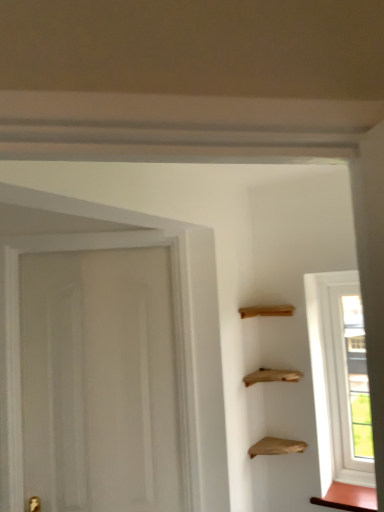
Question: Is wooden shelves at upper right, arranged as the 2th cabinetry when viewed from the right, facing towards transparent glass window at right?

Choices:
 (A) no
 (B) yes

Answer: (A)

Question: Does wooden shelves at upper right, which appears as the second cabinetry when ordered from the bottom, have a greater width compared to transparent glass window at right?

Choices:
 (A) no
 (B) yes

Answer: (B)

Question: From the image's perspective, is wooden shelves at upper right, which appears as the first cabinetry when viewed from the top, located above transparent glass window at right?

Choices:
 (A) yes
 (B) no

Answer: (A)

Question: Is wooden shelves at upper right, which appears as the second cabinetry when ordered from the bottom, bigger than transparent glass window at right?

Choices:
 (A) no
 (B) yes

Answer: (B)

Question: Is wooden shelves at upper right, which appears as the second cabinetry when ordered from the bottom, positioned with its back to transparent glass window at right?

Choices:
 (A) yes
 (B) no

Answer: (B)

Question: Is wooden shelves at upper right, the 1th cabinetry when ordered from left to right, outside of transparent glass window at right?

Choices:
 (A) no
 (B) yes

Answer: (B)

Question: Considering the relative sizes of transparent glass window at right and matte brown cabinet at lower right, marked as the first cabinetry in a right-to-left arrangement, in the image provided, is transparent glass window at right wider than matte brown cabinet at lower right, marked as the first cabinetry in a right-to-left arrangement,?

Choices:
 (A) no
 (B) yes

Answer: (A)

Question: Is transparent glass window at right thinner than matte brown cabinet at lower right, marked as the first cabinetry in a right-to-left arrangement?

Choices:
 (A) no
 (B) yes

Answer: (B)

Question: Does transparent glass window at right appear on the left side of matte brown cabinet at lower right, which is the 1th cabinetry in bottom-to-top order?

Choices:
 (A) yes
 (B) no

Answer: (B)

Question: From the image's perspective, is transparent glass window at right located beneath matte brown cabinet at lower right, the second cabinetry viewed from the top?

Choices:
 (A) yes
 (B) no

Answer: (B)

Question: Is transparent glass window at right shorter than matte brown cabinet at lower right, which ranks as the 2th cabinetry in left-to-right order?

Choices:
 (A) yes
 (B) no

Answer: (B)

Question: Is matte brown cabinet at lower right, the second cabinetry viewed from the top, located within transparent glass window at right?

Choices:
 (A) no
 (B) yes

Answer: (A)

Question: From the image's perspective, would you say matte brown cabinet at lower right, which is the 1th cabinetry in bottom-to-top order, is shown under wooden shelves at upper right, which appears as the second cabinetry when ordered from the bottom?

Choices:
 (A) no
 (B) yes

Answer: (B)